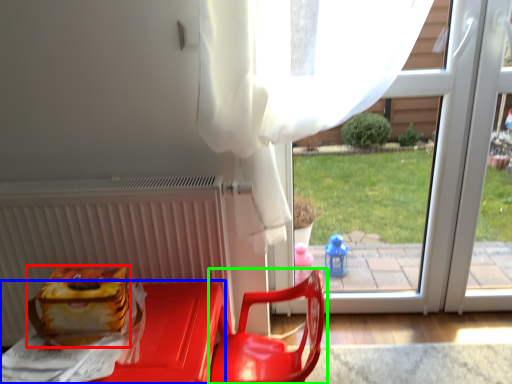
Question: Based on their relative distances, which object is nearer to lunch box (highlighted by a red box)? Choose from furniture (highlighted by a blue box) and chair (highlighted by a green box).

Choices:
 (A) furniture
 (B) chair

Answer: (A)